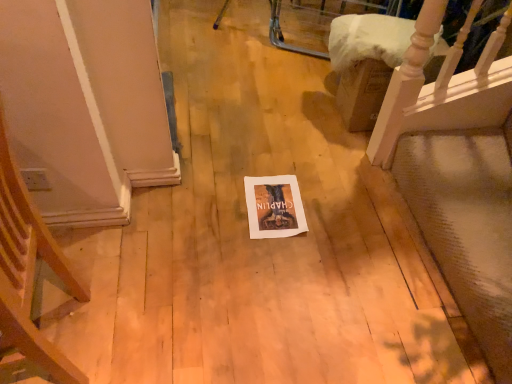
Locate an element on the screen. free point in front of white paper at center is located at coordinates (276, 261).